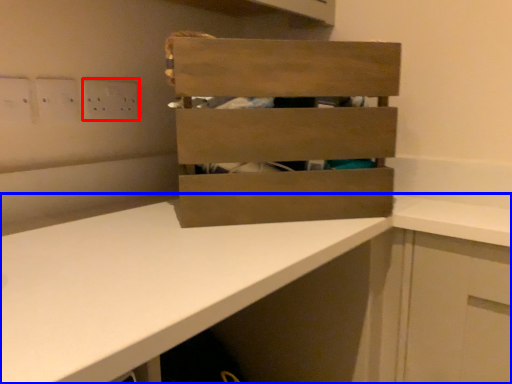
Question: Which object is further to the camera taking this photo, electric outlet (highlighted by a red box) or countertop (highlighted by a blue box)?

Choices:
 (A) electric outlet
 (B) countertop

Answer: (A)